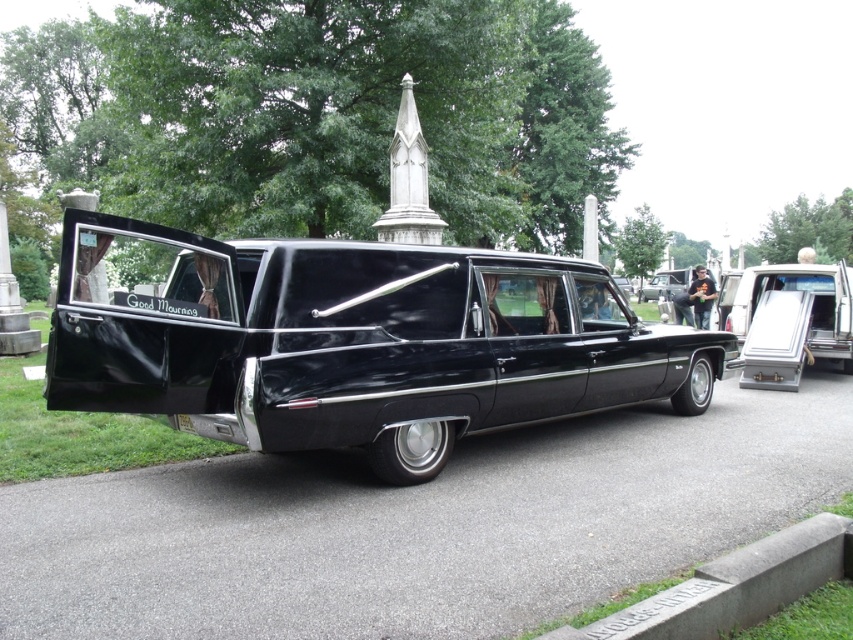
You are a delivery person who needs to load a metallic silver casket at center into the black glossy hearse at center. Can the casket fit inside the hearse based on their sizes?

The black glossy hearse at center is shorter than the metallic silver casket at center, so the casket cannot fit inside the hearse.

You are standing in the cemetery and want to take a photo of the black glossy hearse at center and the metallic silver casket at center. Which object should you focus on first to ensure it appears larger in your photo?

The black glossy hearse at center is in front of the metallic silver casket at center, so focusing on it will make it appear larger in the photo.

You are a funeral director trying to load the metallic silver casket at center into the black glossy hearse at center. Based on their positions, can you determine if the casket is already inside the hearse?

The black glossy hearse at center is positioned under the metallic silver casket at center, which means the casket is not yet inside the hearse and is being loaded into it.